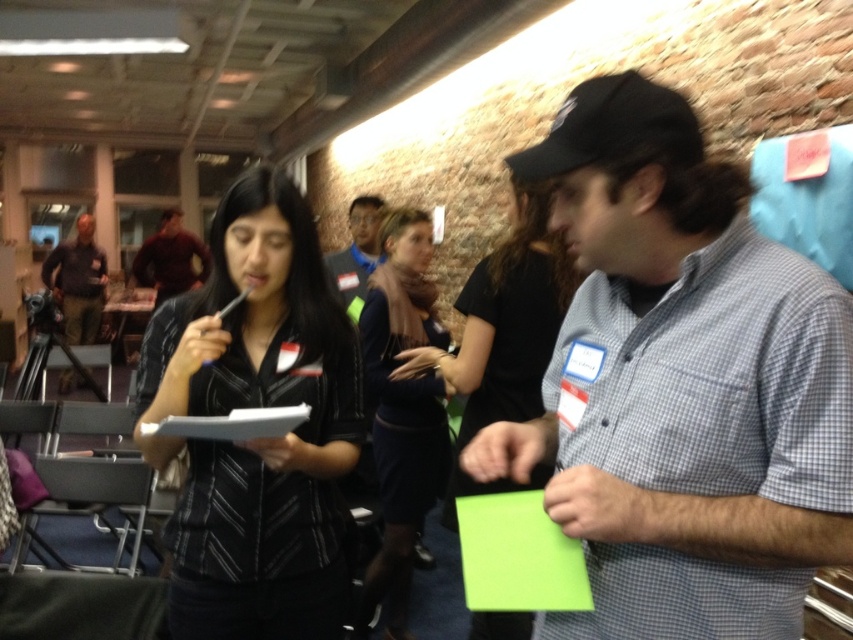
Who is shorter, gray checkered shirt at center or black fabric dress at center?

Standing shorter between the two is gray checkered shirt at center.

The height and width of the screenshot is (640, 853). What are the coordinates of `gray checkered shirt at center` in the screenshot? It's located at (682, 385).

This screenshot has width=853, height=640. Describe the element at coordinates (682, 385) in the screenshot. I see `gray checkered shirt at center` at that location.

Locate an element on the screen. This screenshot has height=640, width=853. gray checkered shirt at center is located at coordinates (682, 385).

Which of these two, black fabric dress at center or matte brown shirt at left, stands shorter?

With less height is black fabric dress at center.

You are a GUI agent. You are given a task and a screenshot of the screen. Output one action in this format:
    pyautogui.click(x=<x>, y=<y>)
    Task: Click on the black fabric dress at center
    The width and height of the screenshot is (853, 640).
    Given the screenshot: What is the action you would take?
    pyautogui.click(x=503, y=332)

Does point (506, 611) come farther from viewer compared to point (61, 288)?

No, it is in front of (61, 288).

The image size is (853, 640). In order to click on black fabric dress at center in this screenshot , I will do `click(503, 332)`.

How distant is black fabric dress at center from dark blue dress at center?

The distance of black fabric dress at center from dark blue dress at center is 33.87 centimeters.

What do you see at coordinates (503, 332) in the screenshot? I see `black fabric dress at center` at bounding box center [503, 332].

Is point (518, 412) behind point (392, 268)?

No, (518, 412) is closer to viewer.

Locate an element on the screen. Image resolution: width=853 pixels, height=640 pixels. black fabric dress at center is located at coordinates (503, 332).